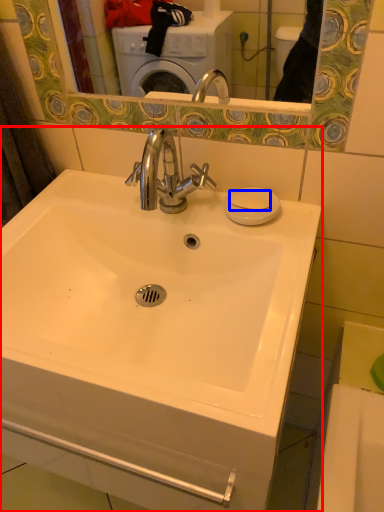
Question: Which of the following is the farthest to the observer, sink (highlighted by a red box) or soap (highlighted by a blue box)?

Choices:
 (A) sink
 (B) soap

Answer: (B)